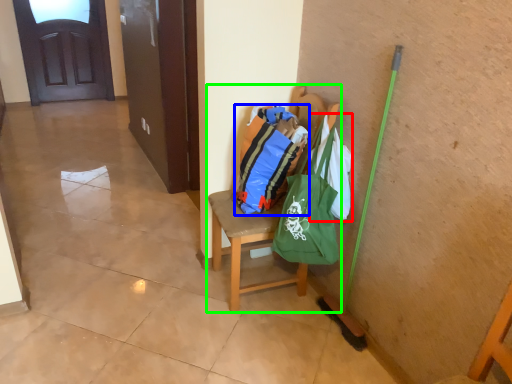
Question: Considering the real-world distances, which object is closest to grocery bag (highlighted by a red box)? shopping bag (highlighted by a blue box) or chair (highlighted by a green box).

Choices:
 (A) shopping bag
 (B) chair

Answer: (A)